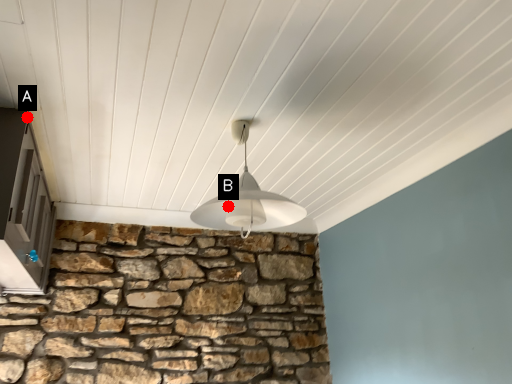
Question: Two points are circled on the image, labeled by A and B beside each circle. Which point is farther from the camera taking this photo?

Choices:
 (A) A is further
 (B) B is further

Answer: (A)